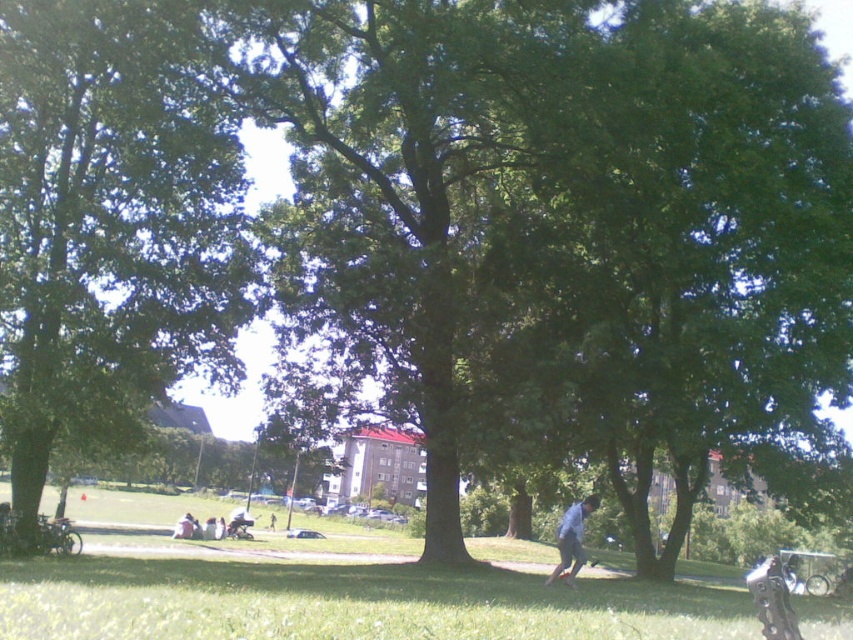
Question: Which point is farther from the camera taking this photo?

Choices:
 (A) (566, 522)
 (B) (271, 528)
 (C) (206, 552)
 (D) (178, 84)

Answer: (B)

Question: Is light brown leather jacket at lower center positioned behind dark blue jeans at center?

Choices:
 (A) yes
 (B) no

Answer: (B)

Question: Which point is closer to the camera taking this photo?

Choices:
 (A) (270, 518)
 (B) (67, 52)
 (C) (184, 524)

Answer: (B)

Question: Is green grass at lower center to the left of light brown leather jacket at lower center from the viewer's perspective?

Choices:
 (A) no
 (B) yes

Answer: (A)

Question: Observing the image, what is the correct spatial positioning of light brown leather jacket at lower center in reference to dark blue jeans at center?

Choices:
 (A) left
 (B) right

Answer: (B)

Question: Which point is closer to the camera?

Choices:
 (A) (457, 636)
 (B) (274, 522)
 (C) (564, 525)
 (D) (180, 17)

Answer: (A)